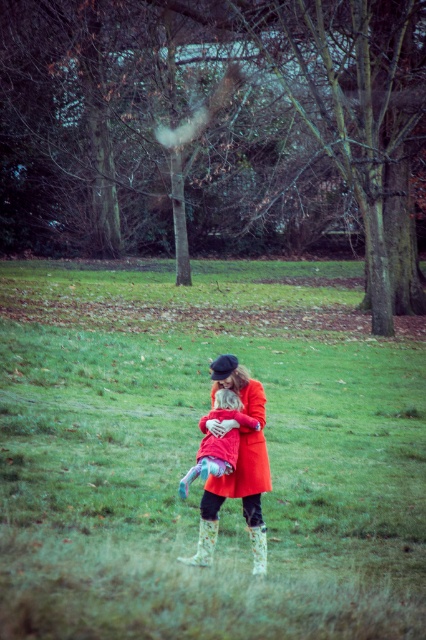
Looking at this image, you are standing in the park and see the green grassy field at center and the matte orange coat at center. Which object is located to the right of the other?

The green grassy field at center is positioned on the right side of matte orange coat at center.

From the picture: You are a delivery robot with a box that is 24 inches wide. You need to navigate between the fluffy pink coat at center and the floral rubber boot at lower center. Can your box fit through the space between them?

The distance between the fluffy pink coat at center and the floral rubber boot at lower center is 25.06 inches. Since the box is 24 inches wide, it can fit through the space between them as there is enough clearance.

You are a photographer trying to capture a photo of the fluffy pink coat at center and the floral rubber boot at lower center. Which object should you focus on first if you want to include both in your frame without moving the camera?

The fluffy pink coat at center is positioned on the left side of the floral rubber boot at lower center, so you should focus on the fluffy pink coat at center first to ensure both are in frame.